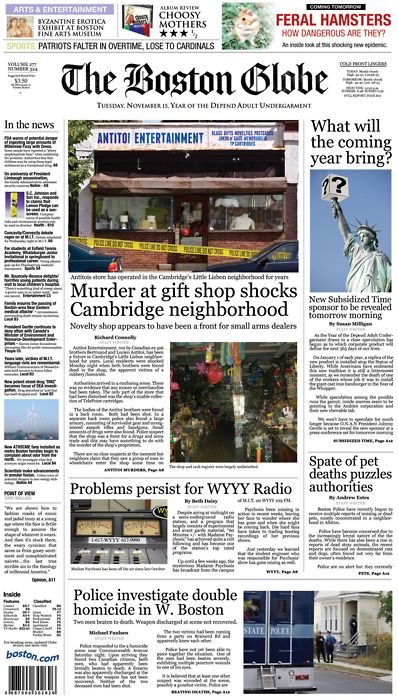
Find the location of a particular element. This screenshot has height=700, width=398. lamp is located at coordinates (122, 216).